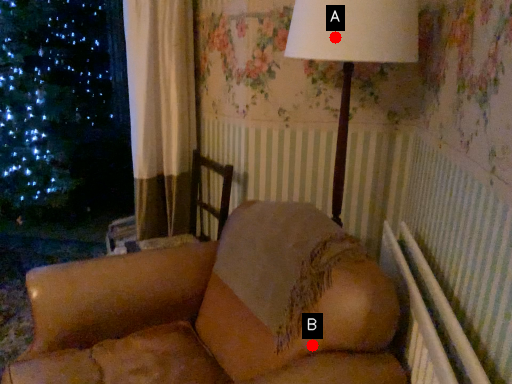
Question: Two points are circled on the image, labeled by A and B beside each circle. Among these points, which one is nearest to the camera?

Choices:
 (A) A is closer
 (B) B is closer

Answer: (B)